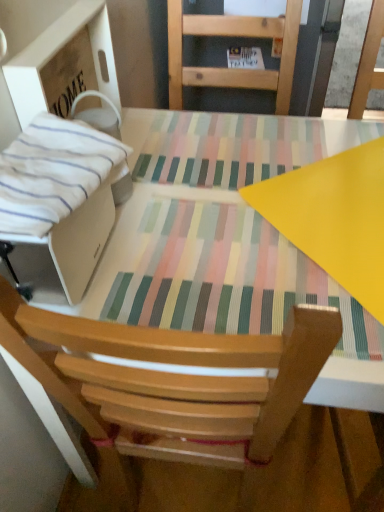
I want to click on white cardboard box at left, so (x=65, y=146).

Is white striped fabric at left shorter than white cardboard box at left?

Correct, white striped fabric at left is not as tall as white cardboard box at left.

From the image's perspective, does white striped fabric at left appear lower than white cardboard box at left?

Yes.

In the scene shown: From a real-world perspective, is white striped fabric at left positioned above or below white cardboard box at left?

white striped fabric at left is above white cardboard box at left.

Is white striped fabric at left touching white cardboard box at left?

Yes, white striped fabric at left is in contact with white cardboard box at left.

Considering the relative sizes of white striped fabric at left and matte plastic table at center in the image provided, is white striped fabric at left taller than matte plastic table at center?

In fact, white striped fabric at left may be shorter than matte plastic table at center.

How many degrees apart are the facing directions of white striped fabric at left and matte plastic table at center?

They differ by 89.7 degrees in their facing directions.

Between point (77, 157) and point (303, 161), which one is positioned behind?

The point (303, 161) is more distant.

Is white striped fabric at left oriented away from matte plastic table at center?

No, white striped fabric at left is not facing the opposite direction of matte plastic table at center.

Locate an element on the screen. cardboard box on the left of white striped fabric at left is located at coordinates (65, 146).

From the image's perspective, is white cardboard box at left over white striped fabric at left?

Indeed, from the image's perspective, white cardboard box at left is shown above white striped fabric at left.

Considering the sizes of objects white cardboard box at left and white striped fabric at left in the image provided, who is shorter, white cardboard box at left or white striped fabric at left?

Standing shorter between the two is white striped fabric at left.

Does white cardboard box at left touch white striped fabric at left?

Yes, white cardboard box at left is beside white striped fabric at left.

Looking at this image, considering the relative positions of matte plastic table at center and white cardboard box at left in the image provided, is matte plastic table at center to the left or to the right of white cardboard box at left?

From the image, it's evident that matte plastic table at center is to the right of white cardboard box at left.

From the picture: From a real-world perspective, is matte plastic table at center positioned above or below white cardboard box at left?

matte plastic table at center is below white cardboard box at left.

Can you confirm if matte plastic table at center is bigger than white cardboard box at left?

Yes.

In terms of height, does white cardboard box at left look taller or shorter compared to matte plastic table at center?

white cardboard box at left is shorter than matte plastic table at center.

Is point (111, 203) closer to camera compared to point (149, 268)?

No, it is not.

Which is correct: white cardboard box at left is inside matte plastic table at center, or outside of it?

white cardboard box at left exists outside the volume of matte plastic table at center.

Is white cardboard box at left closer to camera compared to matte plastic table at center?

No, it is behind matte plastic table at center.

Is matte plastic table at center facing towards white striped fabric at left?

No, matte plastic table at center is not facing towards white striped fabric at left.

How distant is matte plastic table at center from white striped fabric at left?

matte plastic table at center is 11.85 inches from white striped fabric at left.

From a real-world perspective, who is located higher, matte plastic table at center or white striped fabric at left?

In real-world perspective, white striped fabric at left is above.

Based on their sizes in the image, would you say matte plastic table at center is bigger or smaller than white striped fabric at left?

matte plastic table at center is bigger than white striped fabric at left.

The height and width of the screenshot is (512, 384). In order to click on cardboard box below the white striped fabric at left (from a real-world perspective) in this screenshot , I will do `click(65, 146)`.

Where is `round table located behind the white striped fabric at left`? round table located behind the white striped fabric at left is located at coordinates (226, 241).

Considering their positions, is white cardboard box at left positioned closer to white striped fabric at left than matte plastic table at center?

white cardboard box at left.

Considering their positions, is matte plastic table at center positioned closer to white cardboard box at left than white striped fabric at left?

white striped fabric at left.

Based on their spatial positions, is white striped fabric at left or white cardboard box at left further from matte plastic table at center?

Based on the image, white striped fabric at left appears to be further to matte plastic table at center.

When comparing their distances from white cardboard box at left, does white striped fabric at left or matte plastic table at center seem further?

The object further to white cardboard box at left is matte plastic table at center.

When comparing their distances from matte plastic table at center, does white cardboard box at left or white striped fabric at left seem further?

white striped fabric at left is further to matte plastic table at center.

Estimate the real-world distances between objects in this image. Which object is further from white striped fabric at left, matte plastic table at center or white cardboard box at left?

matte plastic table at center is further to white striped fabric at left.

Where is `blanket between white cardboard box at left and matte plastic table at center vertically`? blanket between white cardboard box at left and matte plastic table at center vertically is located at coordinates (54, 172).